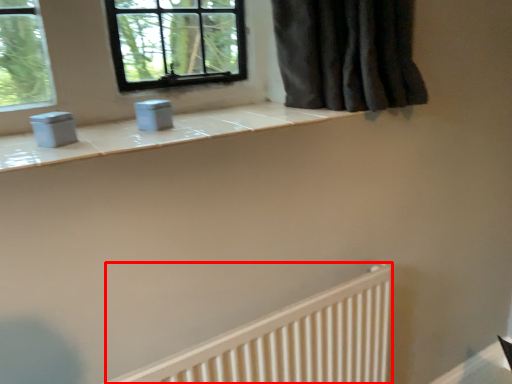
Question: Observing the image, what is the correct spatial positioning of radiator (annotated by the red box) in reference to gray?

Choices:
 (A) left
 (B) right

Answer: (B)